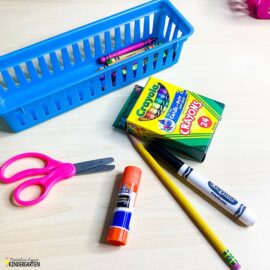
Locate an element on the screen. This screenshot has height=270, width=270. box of crayons is located at coordinates (195, 127).